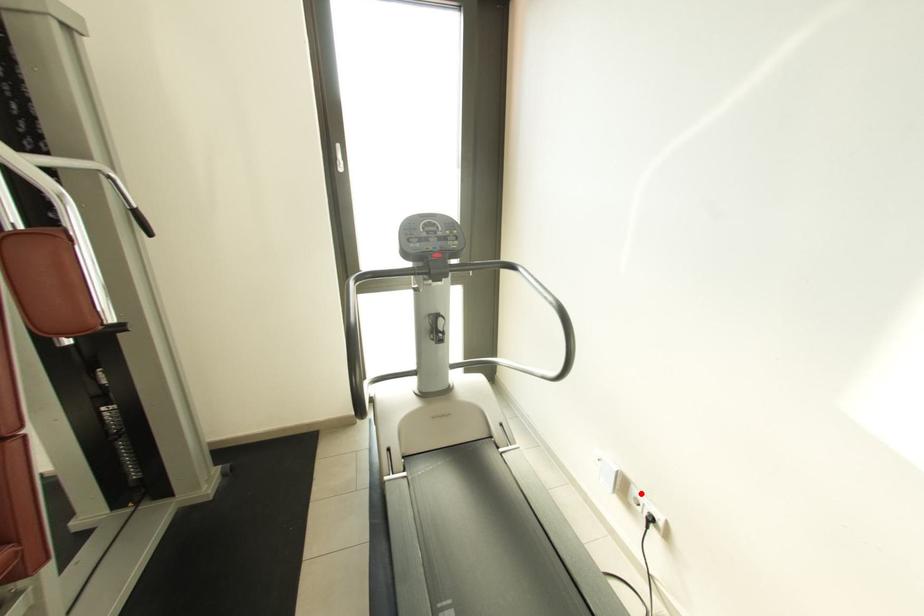
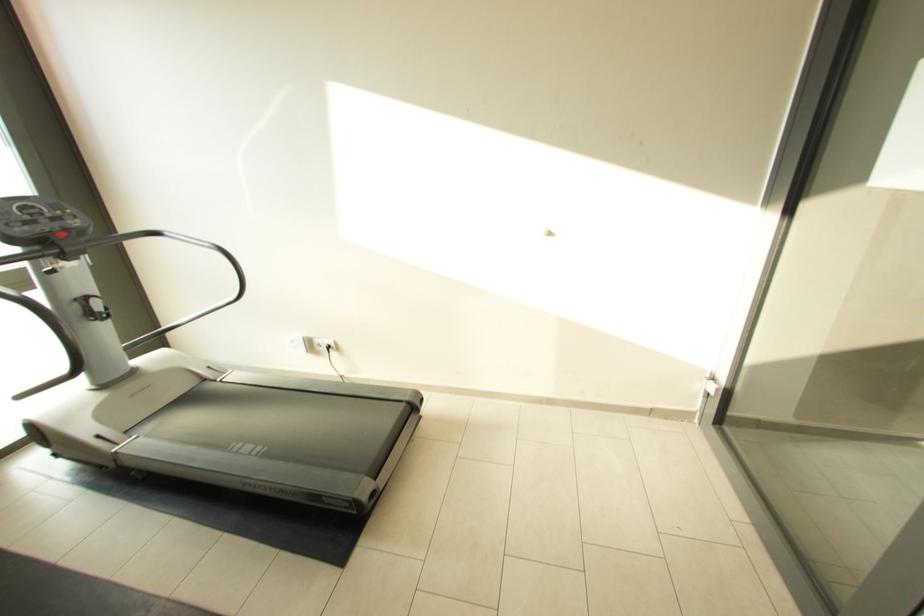
In the second image, find the point that corresponds to the highlighted location in the first image.

(322, 342)